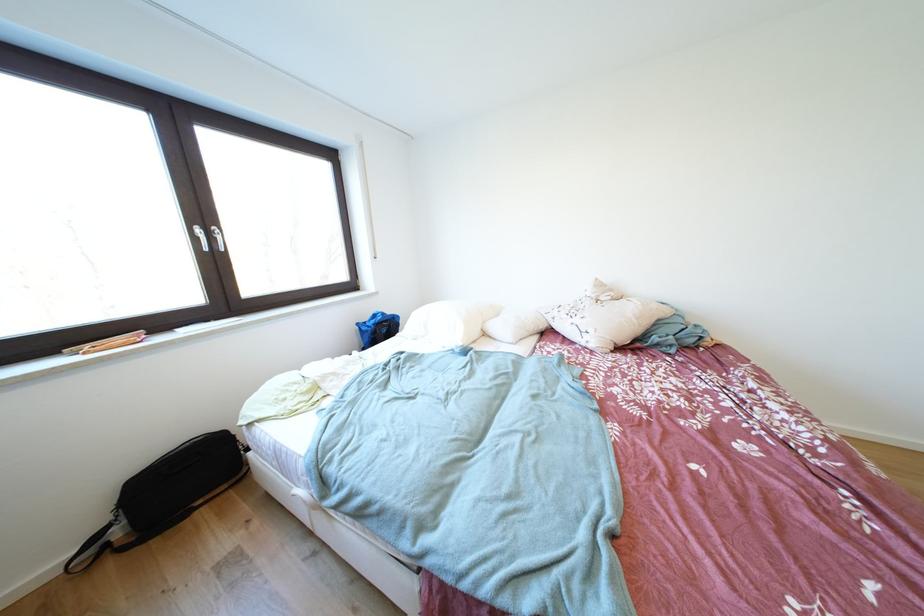
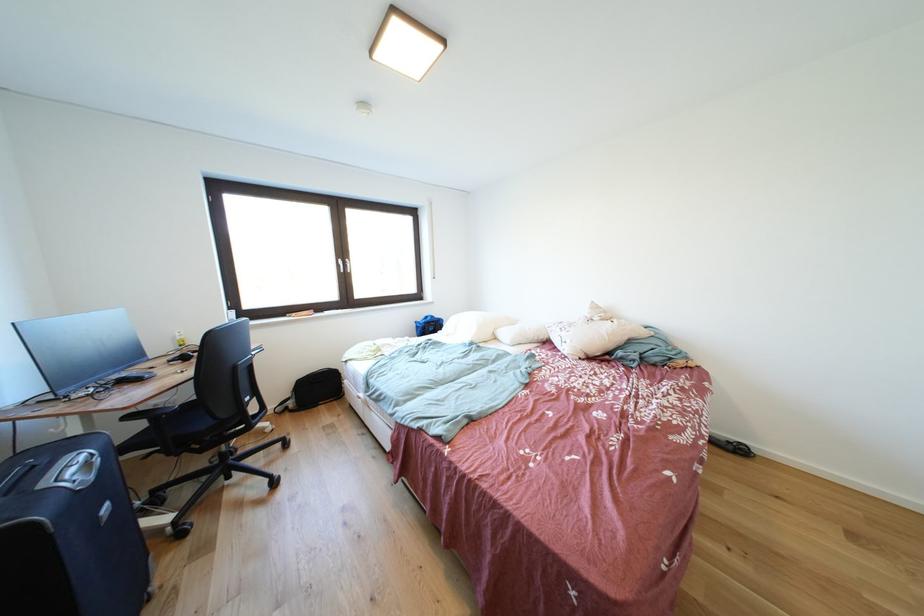
Where in the second image is the point corresponding to (x=396, y=317) from the first image?

(445, 321)